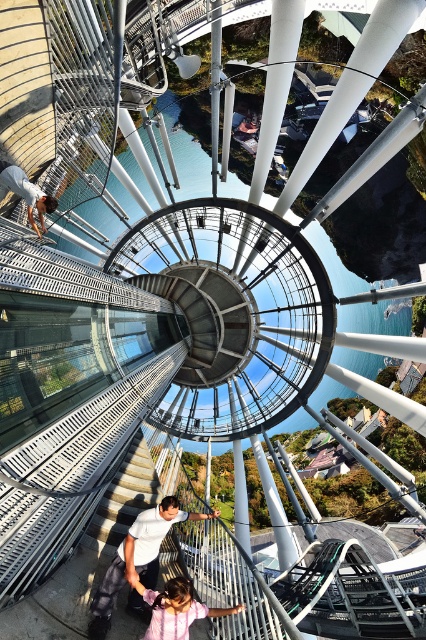
You are standing at the top of the spiral staircase and want to locate the white matte shirt at center. According to the coordinates given, where should you look relative to the staircase?

The white matte shirt at center is located at coordinates point 0.880 on the horizontal axis and 0.322 on the vertical axis, which means it is positioned towards the right side and slightly below the center of the staircase.

You are standing at the top of the spiral staircase and see a white matte shirt at center and a matte white shirt at lower left. Which shirt is positioned to the right when viewed from your current position?

The white matte shirt at center is positioned to the right of the matte white shirt at lower left.